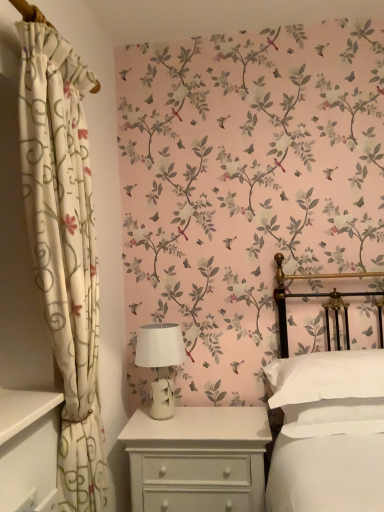
The height and width of the screenshot is (512, 384). In order to click on white soft pillow at right in this screenshot , I will do `click(326, 377)`.

The image size is (384, 512). Describe the element at coordinates (160, 362) in the screenshot. I see `white ceramic table lamp at center` at that location.

Identify the location of white soft pillow at right. This screenshot has height=512, width=384. (326, 377).

Is white floral fabric curtain at left positioned with its back to white ceramic table lamp at center?

No.

Are white floral fabric curtain at left and white ceramic table lamp at center located far from each other?

white floral fabric curtain at left is actually quite close to white ceramic table lamp at center.

Does white floral fabric curtain at left come behind white ceramic table lamp at center?

No, it is in front of white ceramic table lamp at center.

Can you confirm if white floral fabric curtain at left is smaller than white ceramic table lamp at center?

No.

Which of these two, white soft pillow at right or white floral fabric curtain at left, is smaller?

white soft pillow at right.

Between white soft pillow at right and white floral fabric curtain at left, which one is positioned in front?

white floral fabric curtain at left is more forward.

How much distance is there between white soft pillow at right and white floral fabric curtain at left?

white soft pillow at right and white floral fabric curtain at left are 93.12 centimeters apart from each other.

Where is `curtain that appears above the white soft pillow at right (from a real-world perspective)`? This screenshot has width=384, height=512. curtain that appears above the white soft pillow at right (from a real-world perspective) is located at coordinates (64, 248).

Looking at the image, does white floral fabric curtain at left seem bigger or smaller compared to white painted wood nightstand at lower center?

Considering their sizes, white floral fabric curtain at left takes up more space than white painted wood nightstand at lower center.

From the image's perspective, would you say white floral fabric curtain at left is positioned over white painted wood nightstand at lower center?

Yes, from the image's perspective, white floral fabric curtain at left is over white painted wood nightstand at lower center.

Consider the image. Could you tell me if white floral fabric curtain at left is turned towards white painted wood nightstand at lower center?

No, white floral fabric curtain at left is not aimed at white painted wood nightstand at lower center.

In terms of width, does white floral fabric curtain at left look wider or thinner when compared to white painted wood nightstand at lower center?

In the image, white floral fabric curtain at left appears to be more narrow than white painted wood nightstand at lower center.

Is white painted wood nightstand at lower center oriented towards white floral fabric curtain at left?

No, white painted wood nightstand at lower center is not facing towards white floral fabric curtain at left.

Which of these two, white painted wood nightstand at lower center or white floral fabric curtain at left, stands shorter?

white painted wood nightstand at lower center is shorter.

Considering the relative positions of white painted wood nightstand at lower center and white floral fabric curtain at left in the image provided, is white painted wood nightstand at lower center to the right of white floral fabric curtain at left from the viewer's perspective?

Indeed, white painted wood nightstand at lower center is positioned on the right side of white floral fabric curtain at left.

Is white ceramic table lamp at center next to white soft pillow at right and touching it?

No, white ceramic table lamp at center is not with white soft pillow at right.

Consider the image. From a real-world perspective, is white ceramic table lamp at center physically below white soft pillow at right?

No.

Is white ceramic table lamp at center wider than white soft pillow at right?

No, white ceramic table lamp at center is not wider than white soft pillow at right.

How many degrees apart are the facing directions of white ceramic table lamp at center and white soft pillow at right?

The angle between the facing direction of white ceramic table lamp at center and the facing direction of white soft pillow at right is 4.36 degrees.

Is point (145, 448) positioned behind point (351, 394)?

Yes, point (145, 448) is farther from viewer.

Where is `nightstand below the white soft pillow at right (from the image's perspective)`? This screenshot has height=512, width=384. nightstand below the white soft pillow at right (from the image's perspective) is located at coordinates (198, 459).

How different are the orientations of white painted wood nightstand at lower center and white soft pillow at right in degrees?

The angular difference between white painted wood nightstand at lower center and white soft pillow at right is 2.54 degrees.

Looking at the image, does white painted wood nightstand at lower center seem bigger or smaller compared to white soft pillow at right?

In the image, white painted wood nightstand at lower center appears to be larger than white soft pillow at right.

Is white soft pillow at right to the right of white ceramic table lamp at center from the viewer's perspective?

Correct, you'll find white soft pillow at right to the right of white ceramic table lamp at center.

What's the angular difference between white soft pillow at right and white ceramic table lamp at center's facing directions?

The facing directions of white soft pillow at right and white ceramic table lamp at center are 4.36 degrees apart.

Does point (293, 362) come closer to viewer compared to point (151, 388)?

Yes, point (293, 362) is in front of point (151, 388).

Find the location of a particular element. table lamp that is behind the white soft pillow at right is located at coordinates (160, 362).

Where is `table lamp that is under the white floral fabric curtain at left (from a real-world perspective)`? The width and height of the screenshot is (384, 512). table lamp that is under the white floral fabric curtain at left (from a real-world perspective) is located at coordinates pos(160,362).

The width and height of the screenshot is (384, 512). I want to click on curtain that appears in front of the white soft pillow at right, so click(64, 248).

From the image, which object appears to be nearer to white floral fabric curtain at left, white soft pillow at right or white painted wood nightstand at lower center?

Based on the image, white painted wood nightstand at lower center appears to be nearer to white floral fabric curtain at left.

From the image, which object appears to be farther from white ceramic table lamp at center, white painted wood nightstand at lower center or white soft pillow at right?

The object further to white ceramic table lamp at center is white soft pillow at right.

Considering their positions, is white floral fabric curtain at left positioned closer to white soft pillow at right than white painted wood nightstand at lower center?

Among the two, white painted wood nightstand at lower center is located nearer to white soft pillow at right.

When comparing their distances from white soft pillow at right, does white ceramic table lamp at center or white floral fabric curtain at left seem closer?

white ceramic table lamp at center.

Looking at the image, which one is located further to white floral fabric curtain at left, white painted wood nightstand at lower center or white soft pillow at right?

white soft pillow at right is further to white floral fabric curtain at left.

Which object lies further to the anchor point white painted wood nightstand at lower center, white ceramic table lamp at center or white soft pillow at right?

The object further to white painted wood nightstand at lower center is white soft pillow at right.

Looking at the image, which one is located further to white ceramic table lamp at center, white floral fabric curtain at left or white painted wood nightstand at lower center?

The object further to white ceramic table lamp at center is white floral fabric curtain at left.

When comparing their distances from white painted wood nightstand at lower center, does white floral fabric curtain at left or white soft pillow at right seem closer?

white soft pillow at right lies closer to white painted wood nightstand at lower center than the other object.

The width and height of the screenshot is (384, 512). What are the coordinates of `table lamp situated between white floral fabric curtain at left and white soft pillow at right from left to right` in the screenshot? It's located at (160, 362).

Image resolution: width=384 pixels, height=512 pixels. I want to click on table lamp between white floral fabric curtain at left and white painted wood nightstand at lower center in the vertical direction, so click(160, 362).

You are a GUI agent. You are given a task and a screenshot of the screen. Output one action in this format:
    pyautogui.click(x=<x>, y=<y>)
    Task: Click on the nightstand between white ceramic table lamp at center and white soft pillow at right
    
    Given the screenshot: What is the action you would take?
    pyautogui.click(x=198, y=459)

Identify the location of nightstand between white floral fabric curtain at left and white soft pillow at right. Image resolution: width=384 pixels, height=512 pixels. (198, 459).